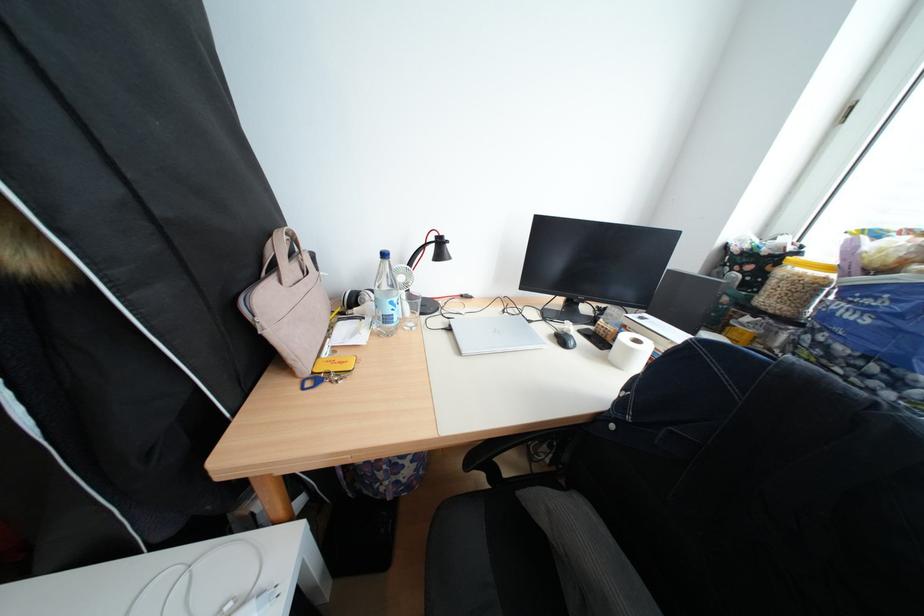
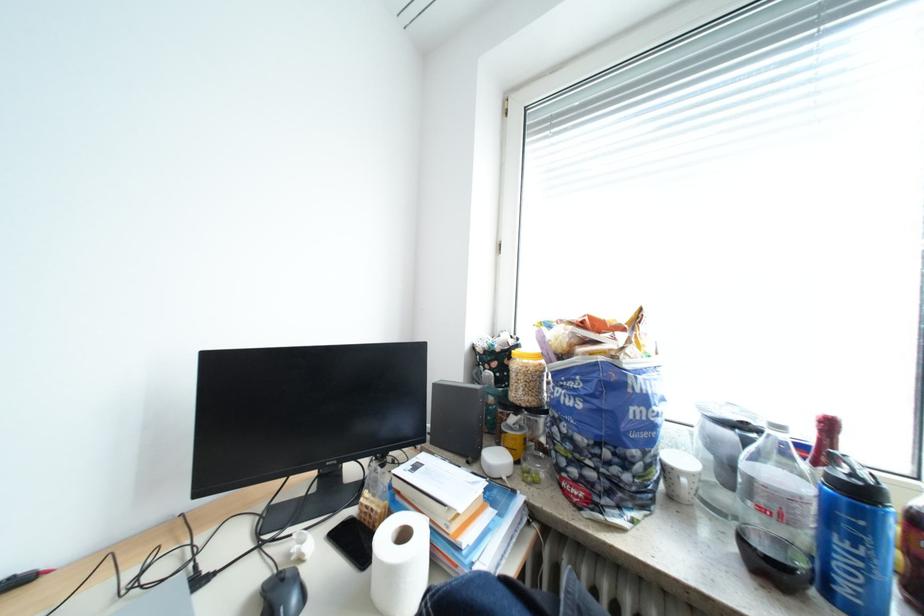
Locate, in the second image, the point that corresponds to pixel 642 351 in the first image.

(404, 573)